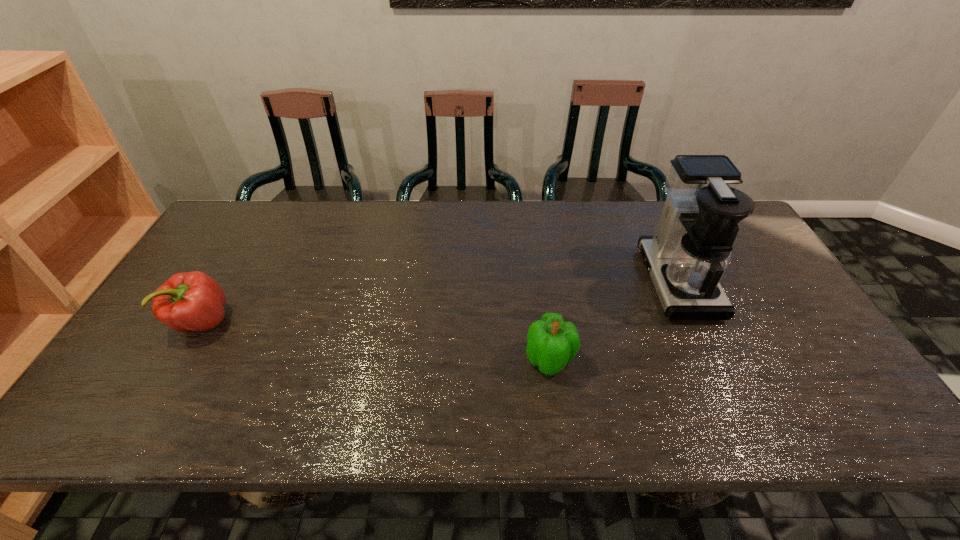
Locate an element on the screen. coffee maker is located at coordinates (690, 251).

Locate an element on the screen. the rightmost object is located at coordinates (690, 251).

In order to click on the left bell pepper in this screenshot , I will do pyautogui.click(x=193, y=301).

Find the location of `the right bell pepper`. the right bell pepper is located at coordinates (552, 343).

The image size is (960, 540). In order to click on free space located at the front of the coffee maker where the controls are located in this screenshot , I will do `click(516, 282)`.

Identify the location of vacant space located at the front of the coffee maker where the controls are located. (559, 282).

At what (x,y) coordinates should I click in order to perform the action: click on free space located at the front of the coffee maker where the controls are located. Please return your answer as a coordinate pair (x, y). This screenshot has height=540, width=960. Looking at the image, I should click on (569, 282).

Image resolution: width=960 pixels, height=540 pixels. Find the location of `vacant area located on the back of the left bell pepper`. vacant area located on the back of the left bell pepper is located at coordinates (260, 222).

This screenshot has height=540, width=960. I want to click on vacant space located 0.070m on the back of the right bell pepper, so click(x=544, y=319).

I want to click on object at the left edge, so click(x=193, y=301).